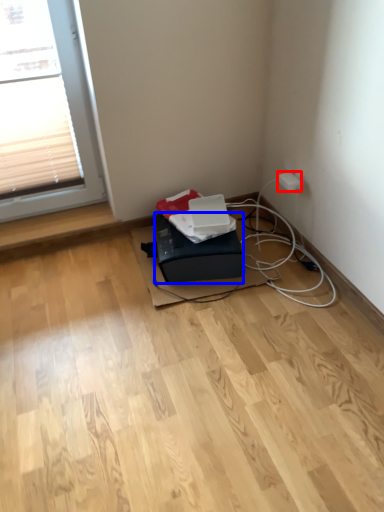
Question: Which of the following is the closest to the observer, electric outlet (highlighted by a red box) or box (highlighted by a blue box)?

Choices:
 (A) electric outlet
 (B) box

Answer: (B)